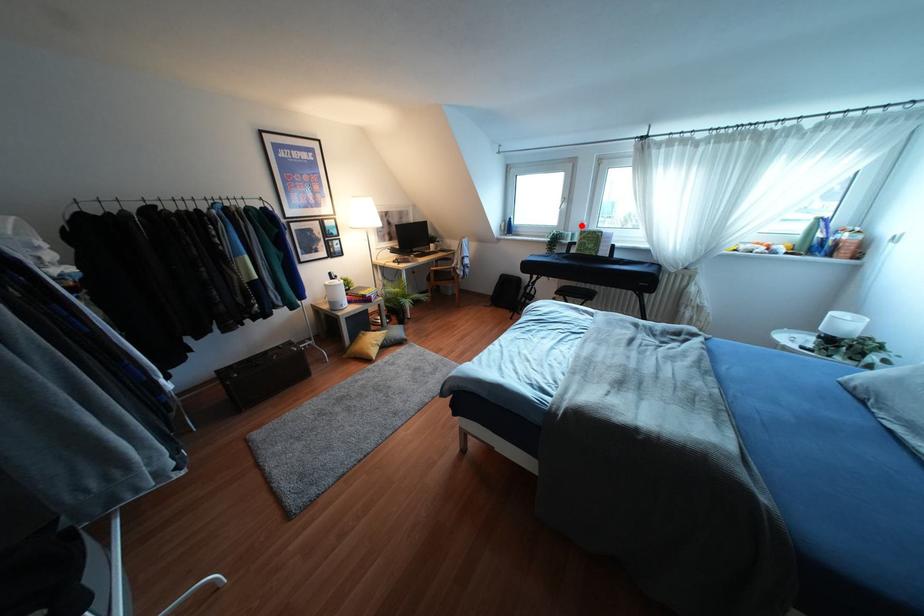
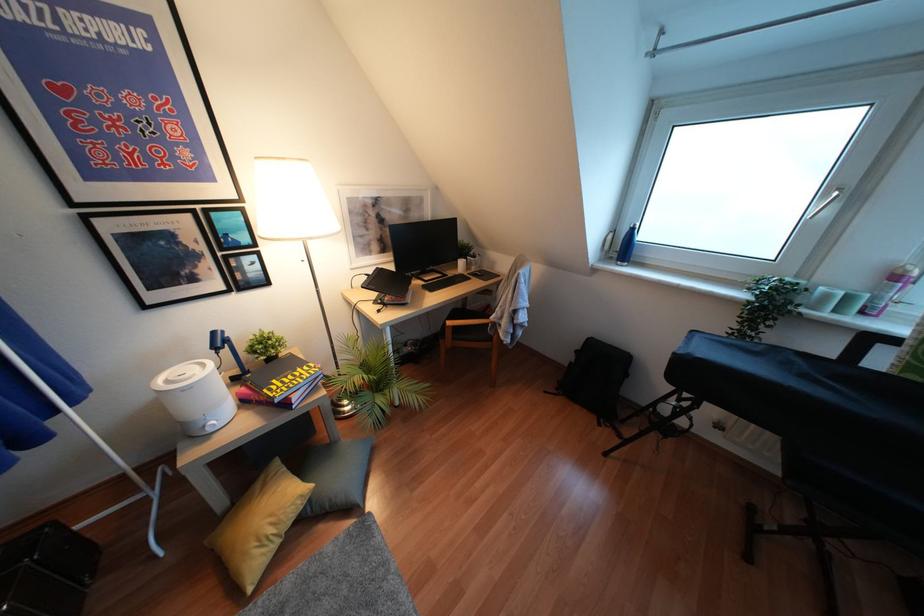
Question: I am providing you with two images of the same scene from different viewpoints. In image1, a red point is highlighted. Considering the same 3D point in image2, which of the following is correct?

Choices:
 (A) It is closer
 (B) It is farther

Answer: (B)